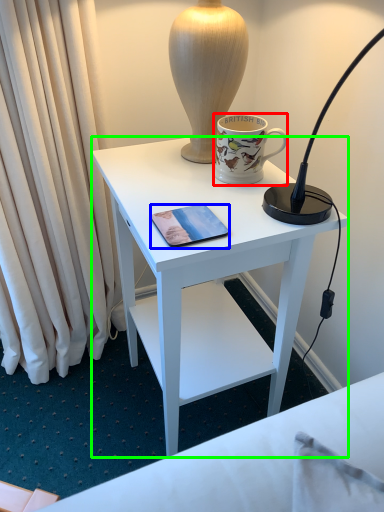
Question: Considering the real-world distances, which object is farthest from coffee cup (highlighted by a red box)? mobile phone (highlighted by a blue box) or desk (highlighted by a green box)?

Choices:
 (A) mobile phone
 (B) desk

Answer: (B)